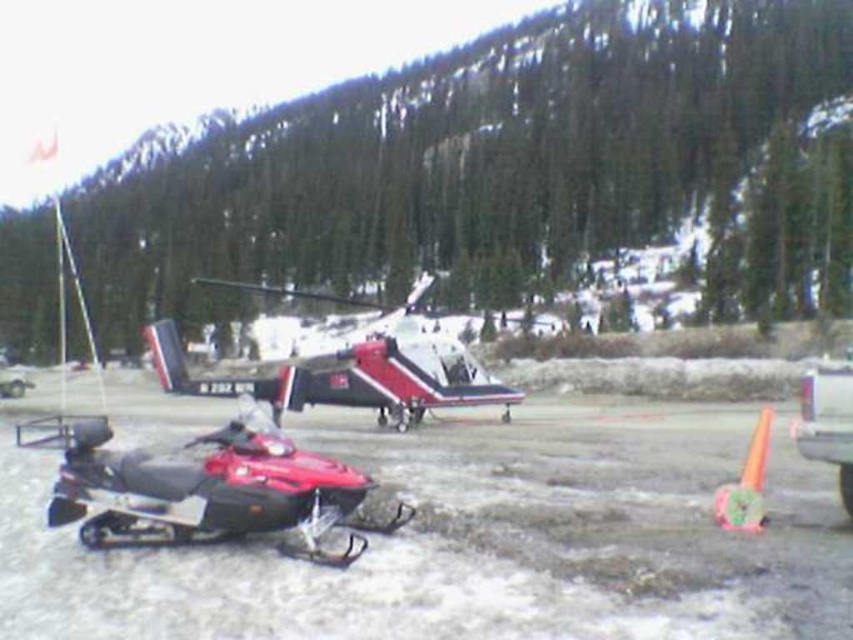
Which of these two, shiny red plastic snowmobile at lower left or orange rubber cone at lower right, stands taller?

shiny red plastic snowmobile at lower left

Is shiny red plastic snowmobile at lower left shorter than orange rubber cone at lower right?

No.

Where is `shiny red plastic snowmobile at lower left`? This screenshot has width=853, height=640. shiny red plastic snowmobile at lower left is located at coordinates (206, 484).

Does point (160, 337) come closer to viewer compared to point (750, 477)?

No.

Locate an element on the screen. white matte helicopter at center is located at coordinates pyautogui.click(x=347, y=376).

Between shiny red plastic snowmobile at lower left and white matte helicopter at center, which one is positioned lower?

Positioned lower is shiny red plastic snowmobile at lower left.

How much distance is there between shiny red plastic snowmobile at lower left and white matte helicopter at center?

shiny red plastic snowmobile at lower left is 127.02 feet away from white matte helicopter at center.

Is point (332, 484) behind point (167, 336)?

No, it is not.

Where is `shiny red plastic snowmobile at lower left`? The height and width of the screenshot is (640, 853). shiny red plastic snowmobile at lower left is located at coordinates (206, 484).